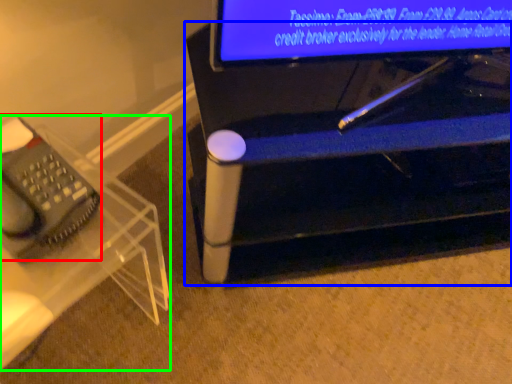
Question: Based on their relative distances, which object is nearer to equipment (highlighted by a red box)? Choose from furniture (highlighted by a blue box) and furniture (highlighted by a green box).

Choices:
 (A) furniture
 (B) furniture

Answer: (B)